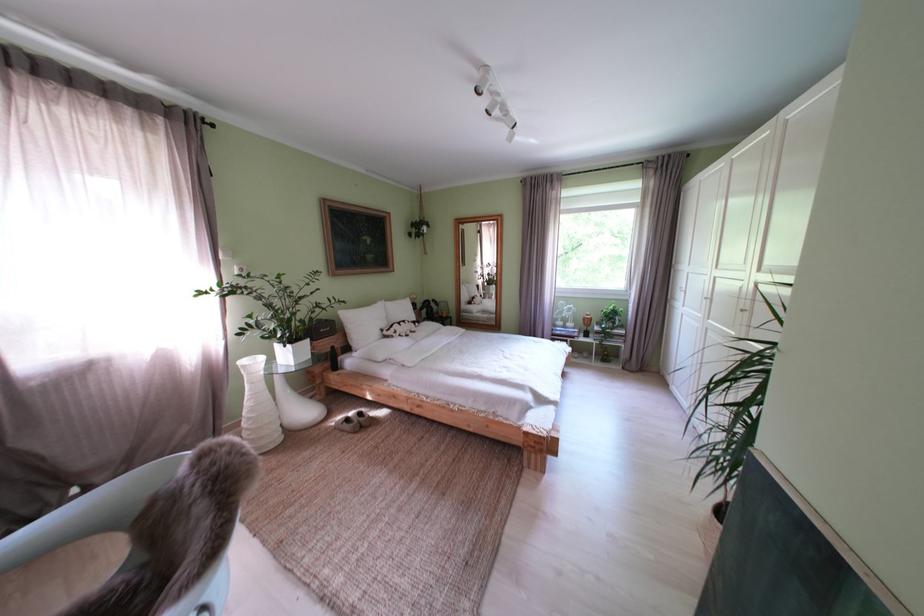
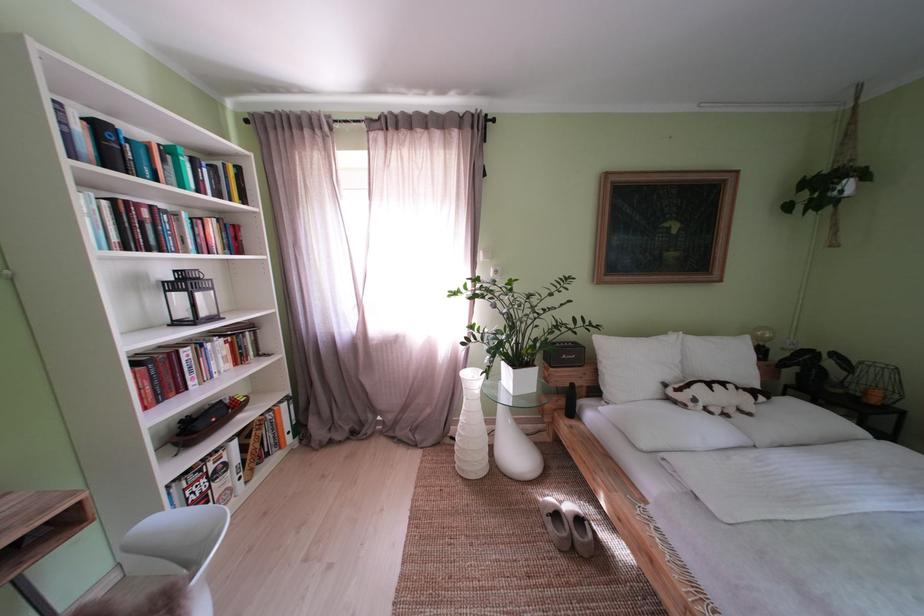
The point at (x=342, y=431) is marked in the first image. Where is the corresponding point in the second image?

(546, 506)